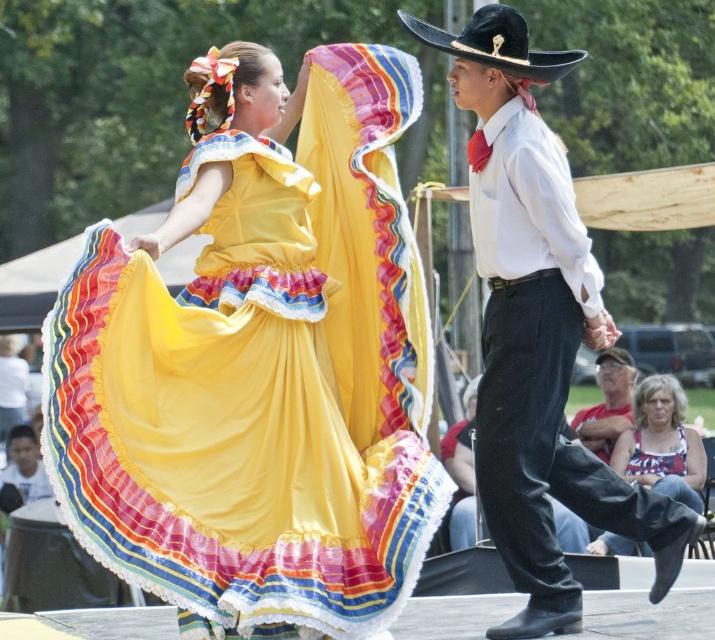
At what (x,y) coordinates should I click in order to perform the action: click on white textured tank top at lower right. Please return your answer as a coordinate pair (x, y). The height and width of the screenshot is (640, 715). Looking at the image, I should click on pyautogui.click(x=661, y=444).

Between white textured tank top at lower right and gray fabric cap at lower right, which one has more height?

Standing taller between the two is white textured tank top at lower right.

Image resolution: width=715 pixels, height=640 pixels. Identify the location of white textured tank top at lower right. (661, 444).

Is silky yellow dress at center above white textured tank top at lower right?

Yes, silky yellow dress at center is above white textured tank top at lower right.

Can you confirm if silky yellow dress at center is smaller than white textured tank top at lower right?

Incorrect, silky yellow dress at center is not smaller in size than white textured tank top at lower right.

Between point (83, 400) and point (676, 465), which one is positioned in front?

Point (83, 400) is in front.

This screenshot has height=640, width=715. Find the location of `silky yellow dress at center`. silky yellow dress at center is located at coordinates (257, 365).

Is white cotton shirt at center to the right of black felt cowboy hat at upper center from the viewer's perspective?

Correct, you'll find white cotton shirt at center to the right of black felt cowboy hat at upper center.

Does white cotton shirt at center have a greater width compared to black felt cowboy hat at upper center?

No.

From the picture: Who is more distant from viewer, [513,618] or [453,42]?

The point [453,42] is behind.

At what (x,y) coordinates should I click in order to perform the action: click on white cotton shirt at center. Please return your answer as a coordinate pair (x, y). The height and width of the screenshot is (640, 715). Looking at the image, I should click on (537, 330).